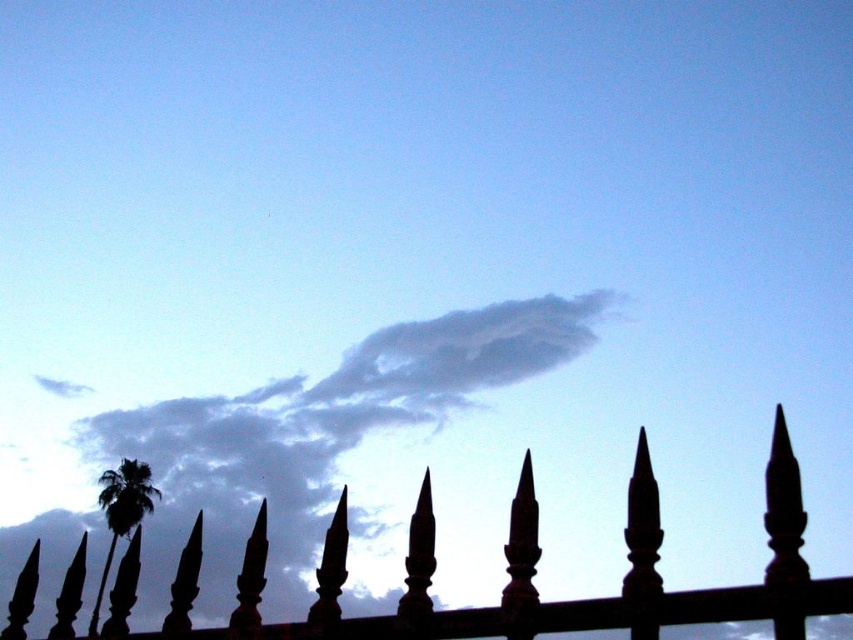
Question: Which object is the closest to the white fluffy cloud at upper center?

Choices:
 (A) green leafy palm at lower left
 (B) black wrought iron fence at center

Answer: (A)

Question: Which object is the farthest from the white fluffy cloud at upper center?

Choices:
 (A) black wrought iron fence at center
 (B) green leafy palm at lower left

Answer: (A)

Question: Can you confirm if white fluffy cloud at upper center is positioned to the left of green leafy palm at lower left?

Choices:
 (A) yes
 (B) no

Answer: (B)

Question: Observing the image, what is the correct spatial positioning of white fluffy cloud at upper center in reference to black wrought iron fence at center?

Choices:
 (A) left
 (B) right

Answer: (B)

Question: Does black wrought iron fence at center appear under green leafy palm at lower left?

Choices:
 (A) yes
 (B) no

Answer: (B)

Question: Which of the following is the farthest from the observer?

Choices:
 (A) green leafy palm at lower left
 (B) white fluffy cloud at upper center

Answer: (A)